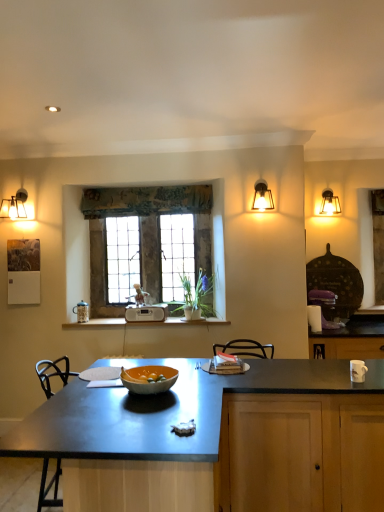
This screenshot has width=384, height=512. I want to click on empty space that is ontop of orange matte glass bowl at center (from a real-world perspective), so click(146, 374).